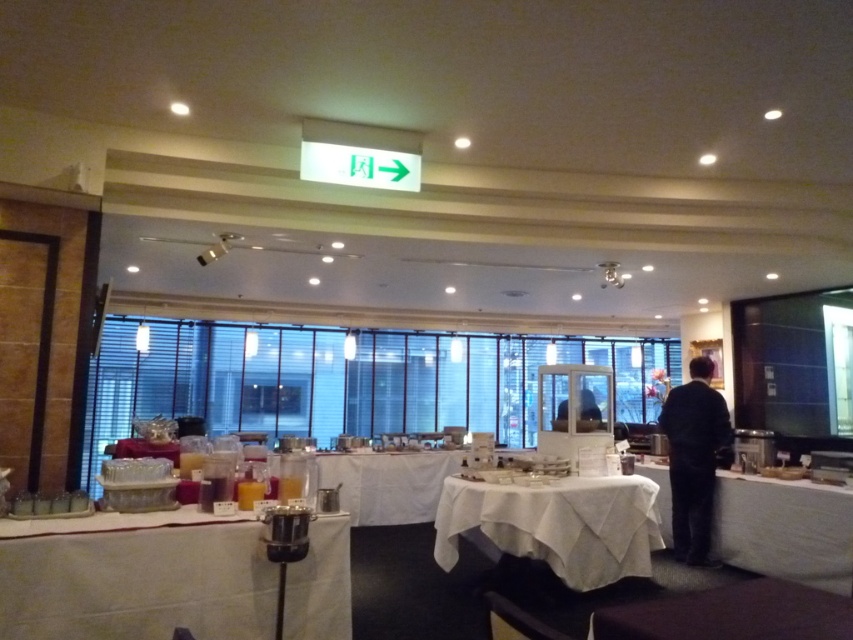
Which is more to the left, white cloth-covered table at lower right or maroon fabric table at lower right?

Positioned to the left is maroon fabric table at lower right.

Identify the location of white cloth-covered table at lower right. (784, 529).

Find the location of a particular element. This screenshot has height=640, width=853. white cloth-covered table at lower right is located at coordinates (784, 529).

In the scene shown: Does metallic silver pot at lower left have a lesser width compared to white cloth-covered table at lower right?

No.

At what (x,y) coordinates should I click in order to perform the action: click on metallic silver pot at lower left. Please return your answer as a coordinate pair (x, y). The width and height of the screenshot is (853, 640). Looking at the image, I should click on (135, 579).

Where is `metallic silver pot at lower left`? Image resolution: width=853 pixels, height=640 pixels. metallic silver pot at lower left is located at coordinates (135, 579).

Consider the image. Who is positioned more to the right, metallic silver pot at lower left or dark suit at right?

From the viewer's perspective, dark suit at right appears more on the right side.

Does metallic silver pot at lower left have a lesser height compared to dark suit at right?

Indeed, metallic silver pot at lower left has a lesser height compared to dark suit at right.

Where is `metallic silver pot at lower left`? The height and width of the screenshot is (640, 853). metallic silver pot at lower left is located at coordinates (135, 579).

Image resolution: width=853 pixels, height=640 pixels. I want to click on metallic silver pot at lower left, so click(x=135, y=579).